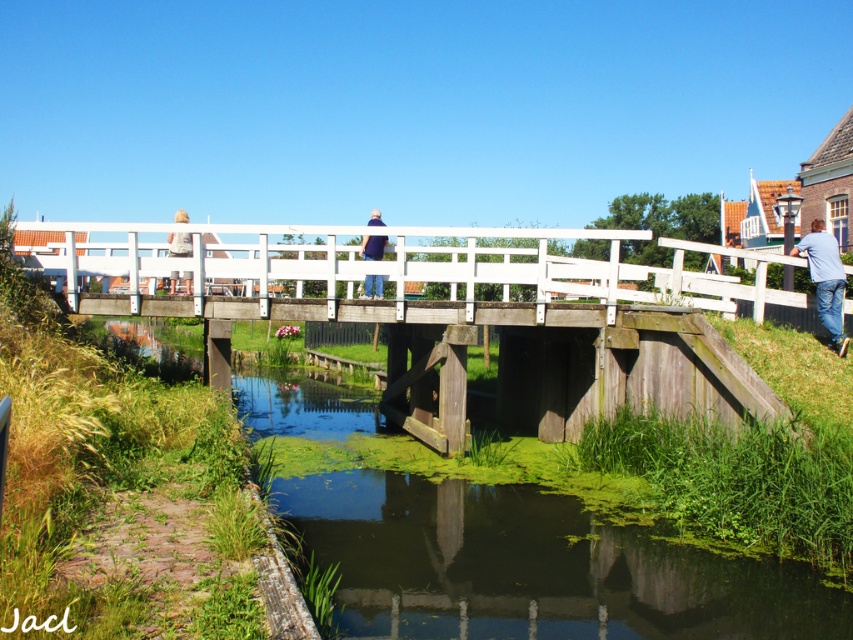
Can you confirm if green algae-covered water at lower center is positioned above blue jeans at right?

No, green algae-covered water at lower center is not above blue jeans at right.

Can you confirm if green algae-covered water at lower center is positioned to the left of blue jeans at right?

Yes, green algae-covered water at lower center is to the left of blue jeans at right.

Identify the location of green algae-covered water at lower center. The height and width of the screenshot is (640, 853). (532, 566).

What do you see at coordinates (457, 316) in the screenshot?
I see `white wooden bridge at center` at bounding box center [457, 316].

Who is more distant from viewer, (132, 278) or (428, 564)?

Point (132, 278)

Where is `white wooden bridge at center`? Image resolution: width=853 pixels, height=640 pixels. white wooden bridge at center is located at coordinates (457, 316).

Between point (808, 250) and point (363, 257), which one is positioned in front?

Point (808, 250) is more forward.

Which of these two, blue jeans at right or blue fabric shirt at center, stands taller?

Standing taller between the two is blue fabric shirt at center.

What are the coordinates of `blue jeans at right` in the screenshot? It's located at (825, 280).

Where is `blue jeans at right`? blue jeans at right is located at coordinates (825, 280).